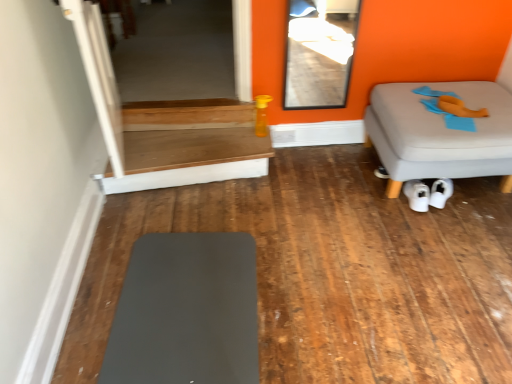
Locate an element on the screen. vacant area that lies in front of wooden table at center is located at coordinates (194, 243).